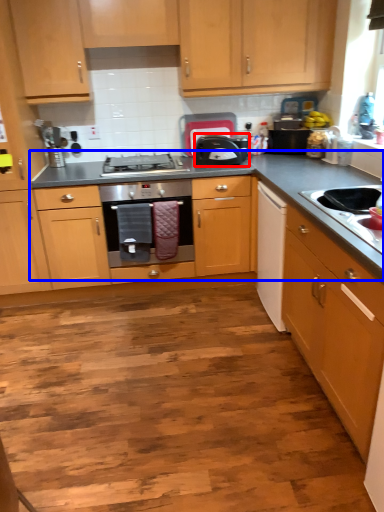
Question: Which object appears farthest to the camera in this image, kitchen appliance (highlighted by a red box) or countertop (highlighted by a blue box)?

Choices:
 (A) kitchen appliance
 (B) countertop

Answer: (A)